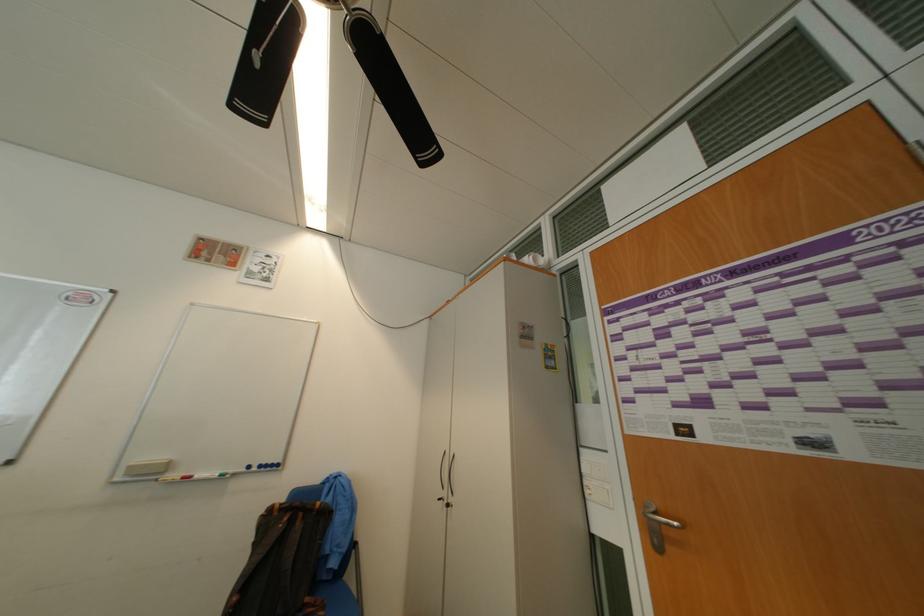
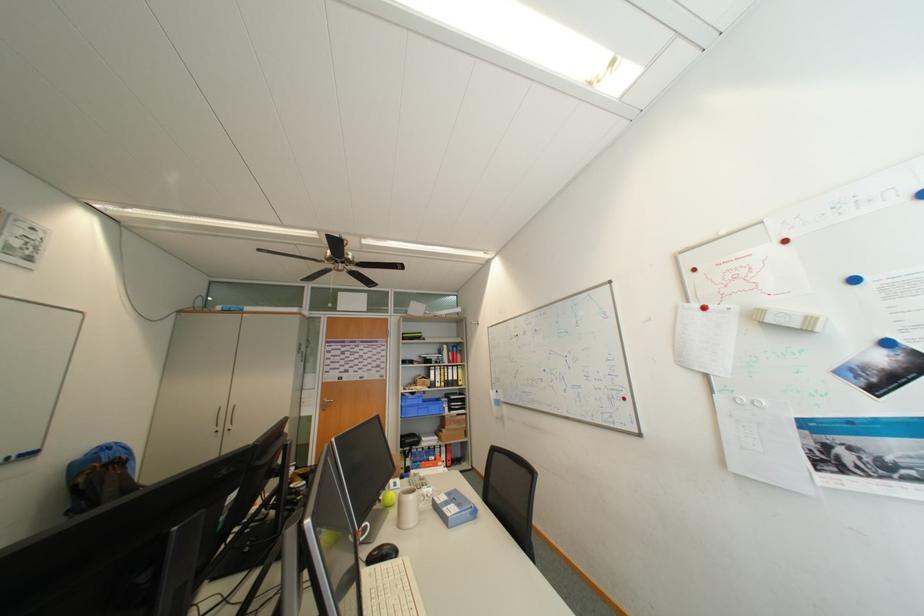
In the second image, find the point that corresponds to (x=454, y=496) in the first image.

(229, 429)